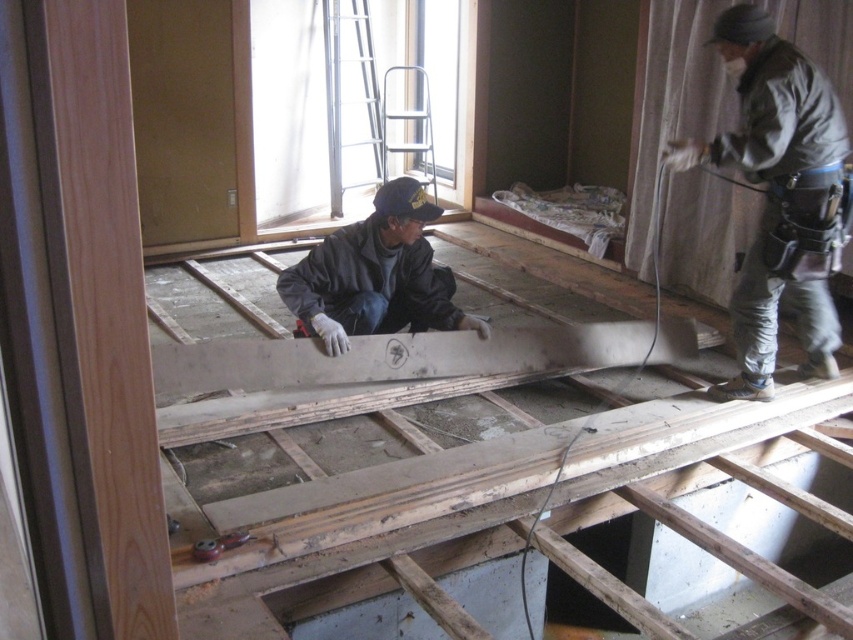
You are a construction worker who needs to move a heavy tool from the black matte jacket at center to the metallic silver ladder at upper center. Given that the tool weighs 20 kg and you can carry it for 2 meters before needing to rest, how many times will you need to rest while moving it?

The distance between the black matte jacket at center and the metallic silver ladder at upper center is 3.10 meters. Since you can carry the tool for 2 meters before needing to rest, you will need to rest once during the move.

You are a safety inspector standing at the entrance of the construction site. You need to locate the gray fabric construction worker at right for a safety check. According to the coordinates provided, where exactly should you look to find them?

The gray fabric construction worker at right is located at coordinates point (772, 188).